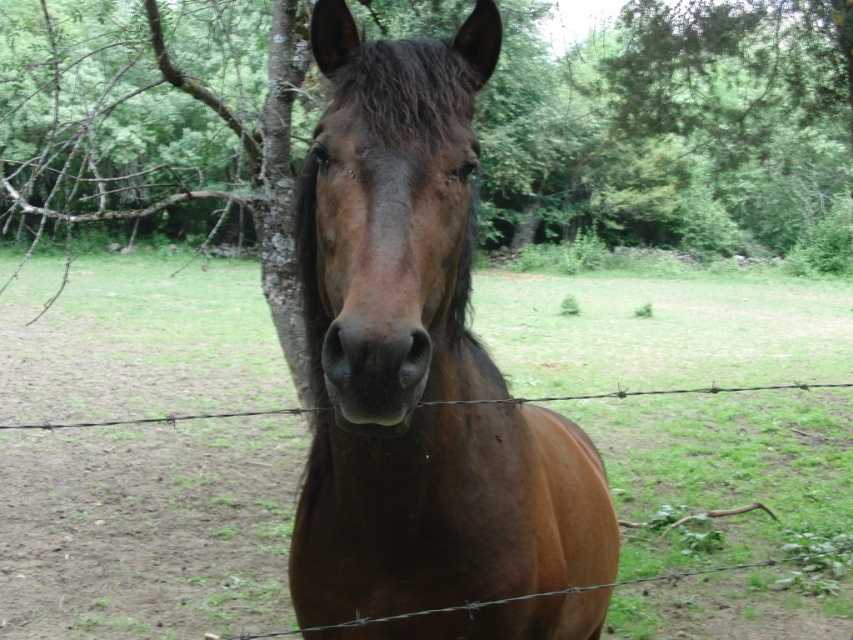
Who is more forward, (781, 444) or (418, 289)?

Positioned in front is point (418, 289).

Is green grass at center further to camera compared to brown glossy horse at center?

Yes, it is.

Who is more distant from viewer, [199,340] or [386,497]?

The point [199,340] is behind.

Where is `green grass at center`? The width and height of the screenshot is (853, 640). green grass at center is located at coordinates (148, 529).